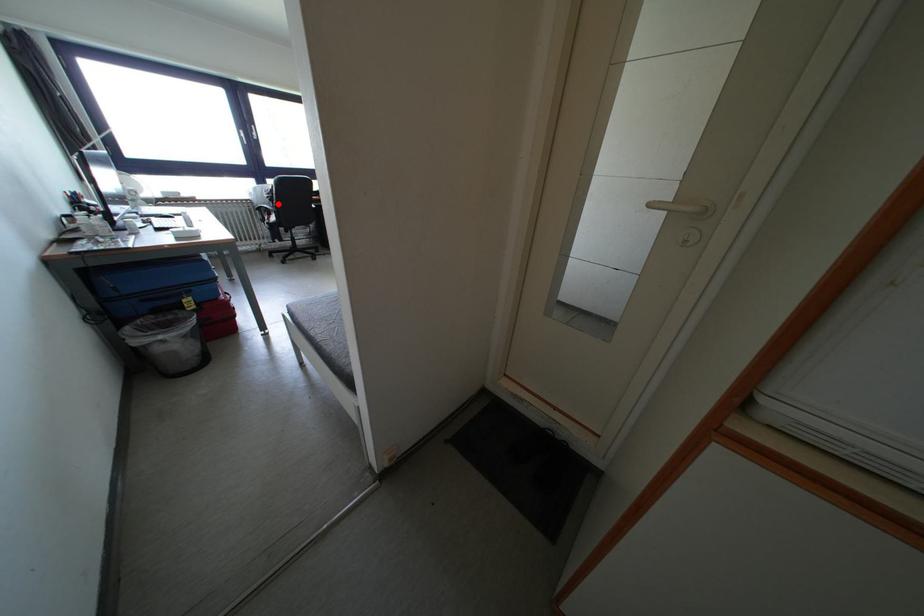
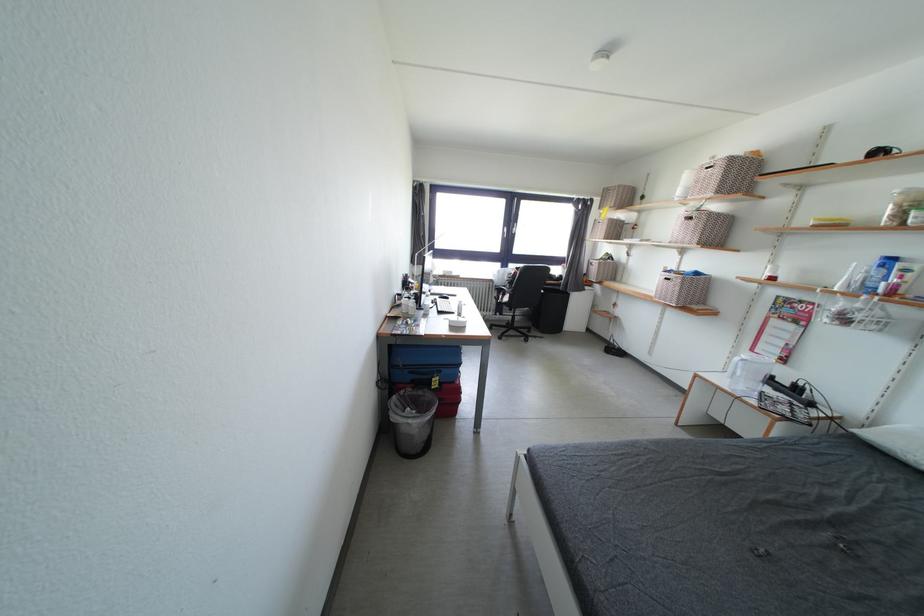
Question: A red point is marked in image1. In image2, is the corresponding 3D point closer to the camera or farther? Reply with the corresponding letter.

Choices:
 (A) The corresponding 3D point is closer.
 (B) The corresponding 3D point is farther.

Answer: (B)